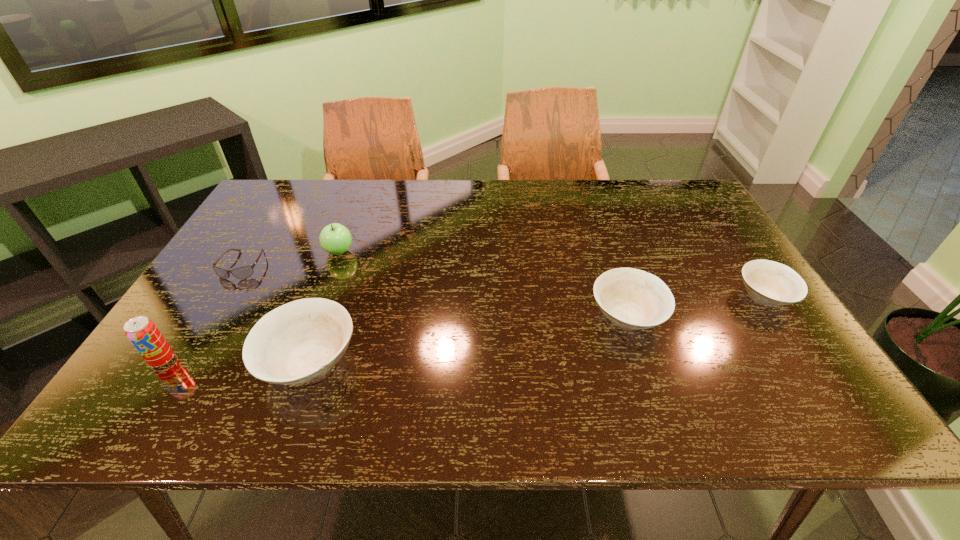
The height and width of the screenshot is (540, 960). In order to click on free location that satisfies the following two spatial constraints: 1. on the lenses of the sunglasses; 2. on the right side of the fifth tallest object in this screenshot , I will do `click(224, 296)`.